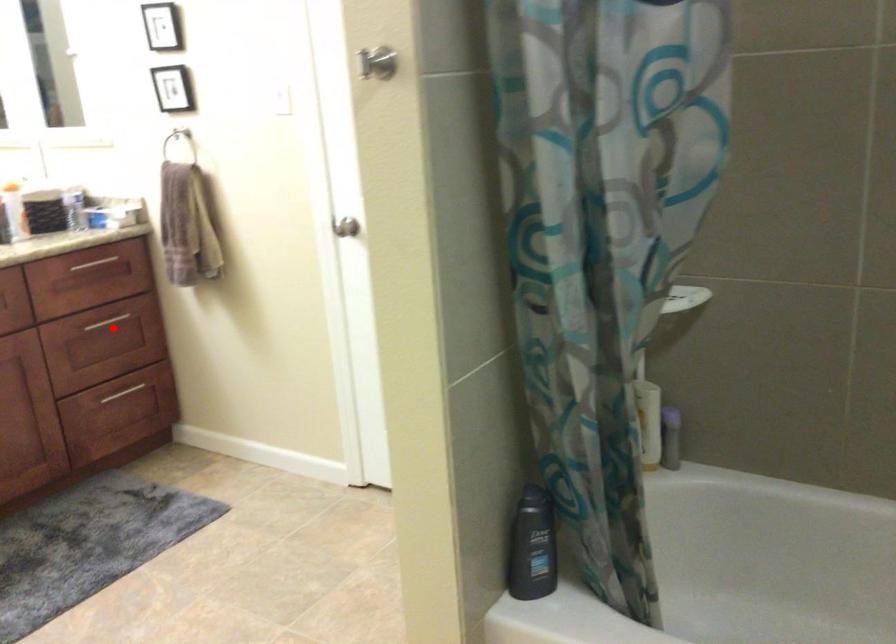
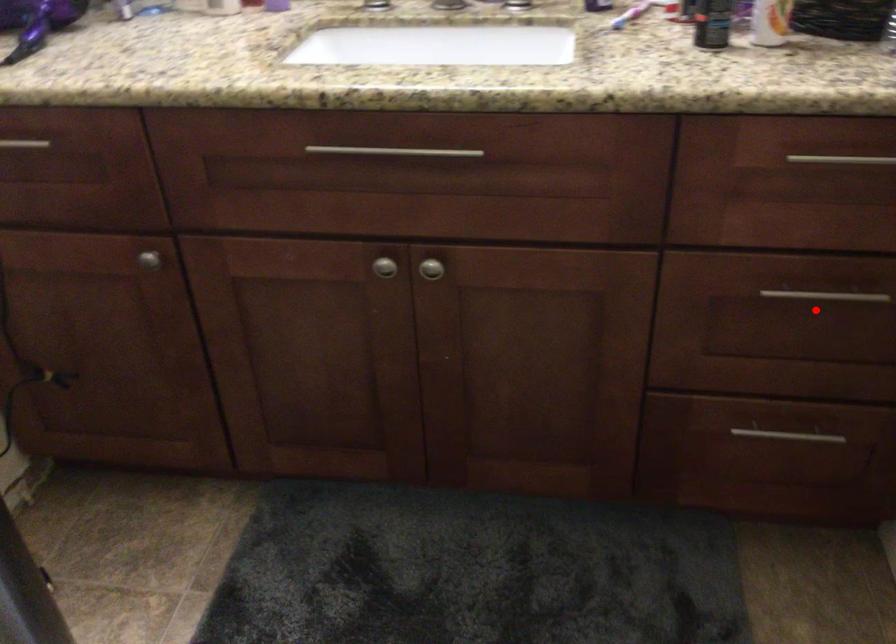
Based on the photo, I am providing you with two images of the same scene from different viewpoints. A red point is marked on the first image and another point is marked on the second image. Are the points marked in image1 and image2 representing the same 3D position?

Yes